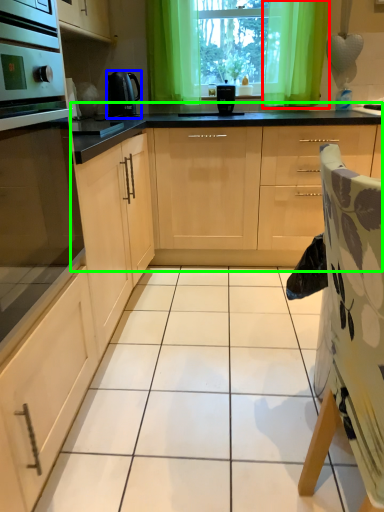
Question: Considering the real-world distances, which object is farthest from curtain (highlighted by a red box)? kitchen appliance (highlighted by a blue box) or cabinetry (highlighted by a green box)?

Choices:
 (A) kitchen appliance
 (B) cabinetry

Answer: (A)